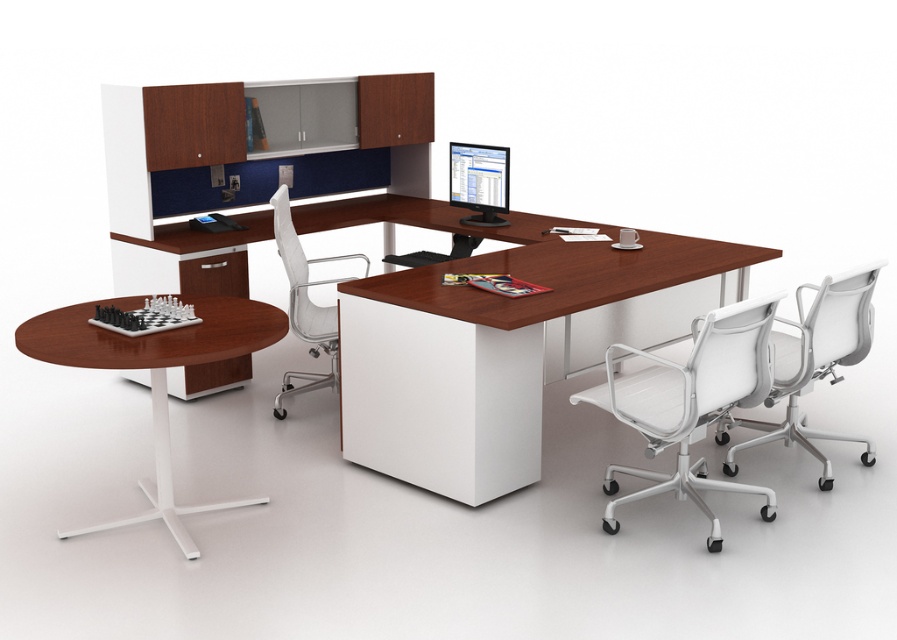
In the scene shown: You are an office worker who wants to sit in the white mesh office chair at center to work on the matte black monitor at center. Based on the scene description, will you have to move to your right or left to face the monitor once seated?

The white mesh office chair at center is positioned on the left side of matte black monitor at center, so you will have to move to your right to face the matte black monitor at center.

You are standing at point A in the office and want to move to the mahogany wood computer desk at center. Which direction should you move? The coordinates of point A are given as point A is at the bottom left corner of the image. The image has a coordinate system where the bottom left corner is the origin point. The coordinate of the mahogany wood computer desk at center is at point (412, 216). Please answer based on the coordinate system provided.

The mahogany wood computer desk at center is located at coordinates (412, 216). Since point A is at the bottom left corner of the image, you should move towards the upper right direction to reach the mahogany wood computer desk at center.

You are an office worker trying to determine if your new standing desk will fit under the desk. The standing desk has a height of 70 cm. Can you place it under the mahogany wood computer desk at center without hitting the white mesh office chair at center?

The mahogany wood computer desk at center is shorter than the white mesh office chair at center. Since the standing desk is 70 cm tall, it may not fit under the desk if the desk is shorter than the chair, but the exact dimensions are not provided. Without knowing the desk height, we can only confirm the relative height between the desk and chair.